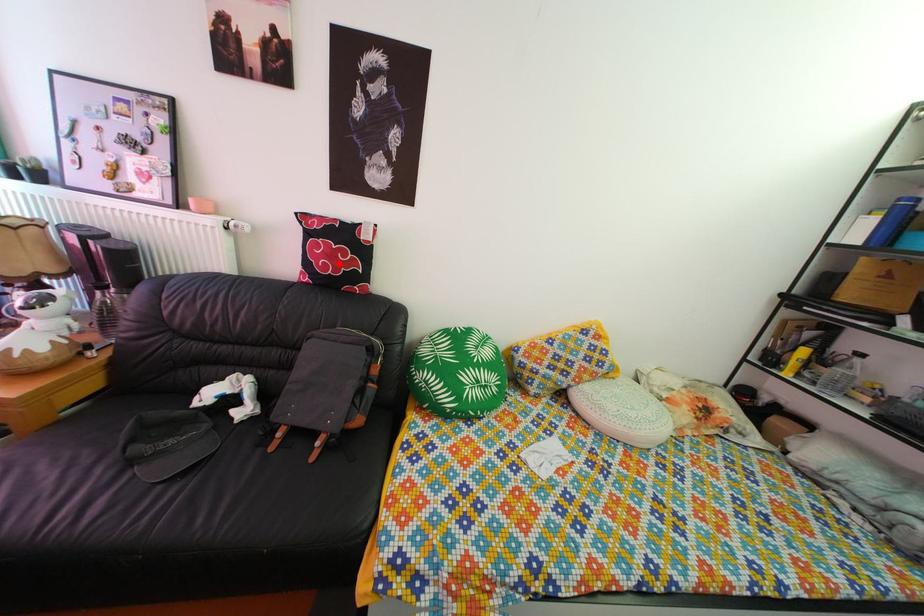
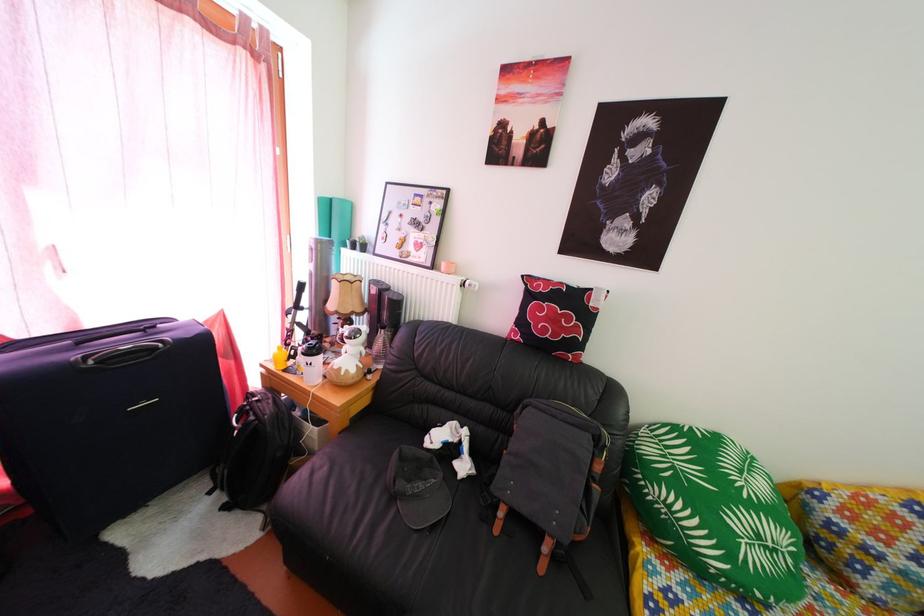
Where in the second image is the point corresponding to the highlighted location from the first image?

(562, 328)